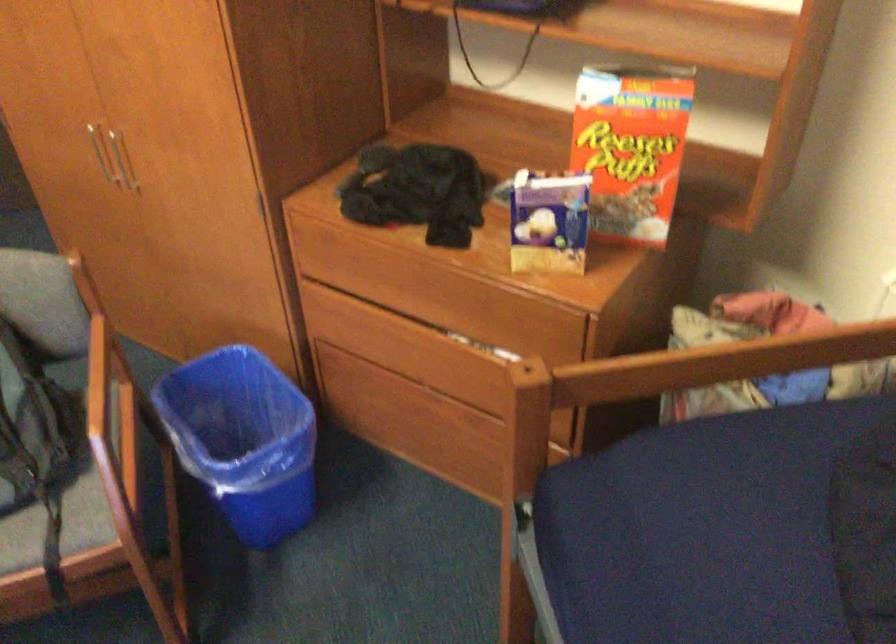
Image resolution: width=896 pixels, height=644 pixels. What do you see at coordinates (67, 372) in the screenshot?
I see `a chair sitting surface` at bounding box center [67, 372].